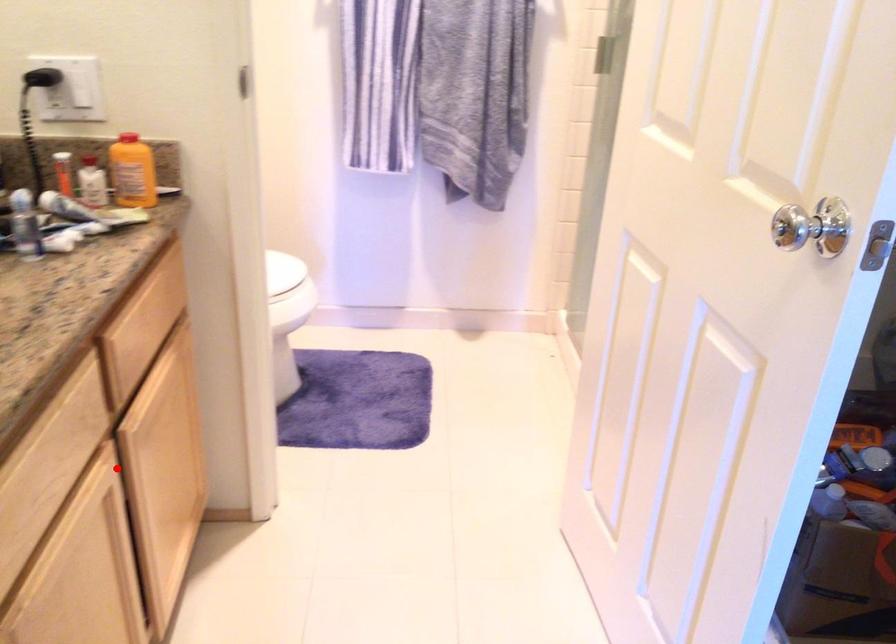
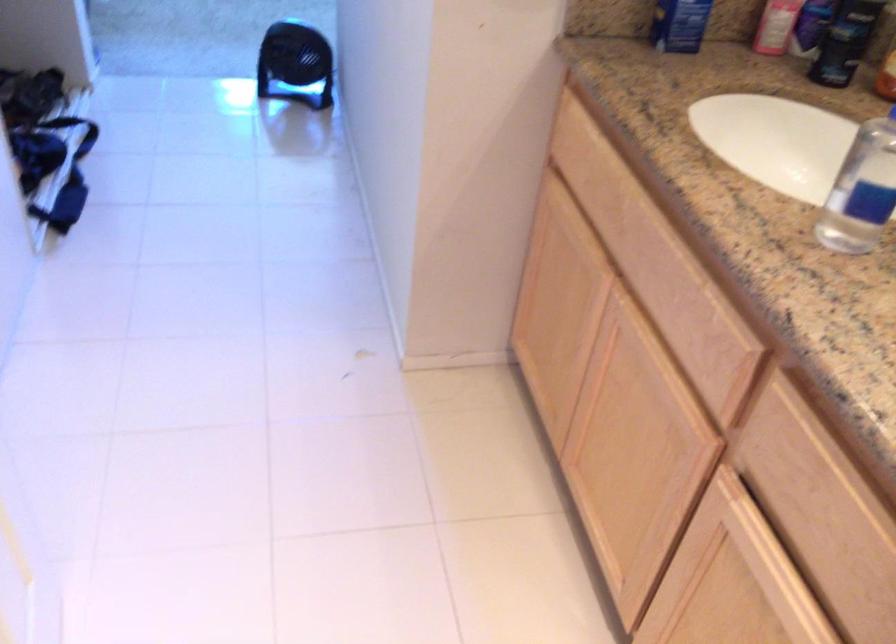
In the second image, find the point that corresponds to the highlighted location in the first image.

(684, 429)